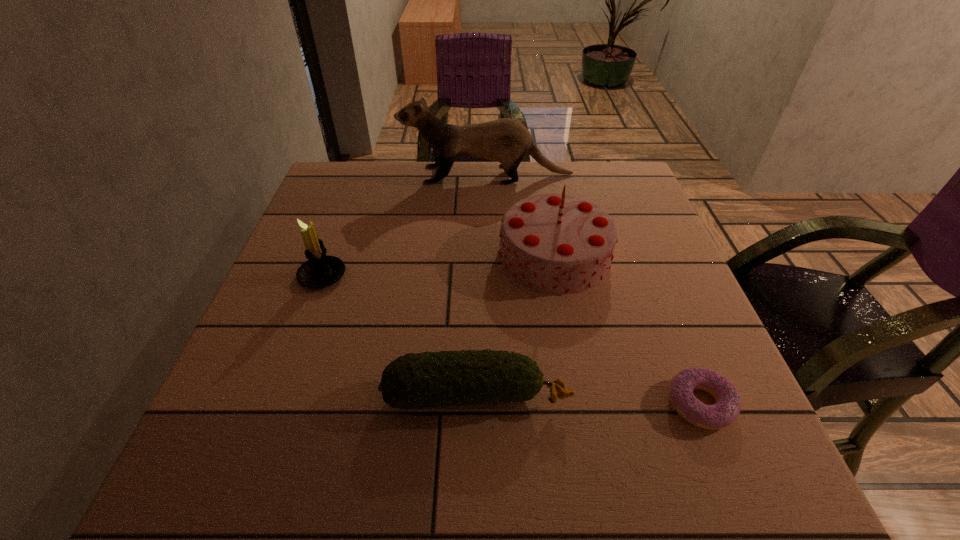
This screenshot has height=540, width=960. Identify the location of vacant region at the right edge of the desktop. (610, 209).

Where is `vacant space at the far left corner of the desktop`? The height and width of the screenshot is (540, 960). vacant space at the far left corner of the desktop is located at coordinates (376, 175).

You are a GUI agent. You are given a task and a screenshot of the screen. Output one action in this format:
    pyautogui.click(x=<x>, y=<y>)
    Task: Click on the vacant space at the near left corner of the desktop
    Image resolution: width=960 pixels, height=540 pixels.
    Given the screenshot: What is the action you would take?
    pyautogui.click(x=187, y=496)

Where is `vacant space at the far right corner of the desktop`? The image size is (960, 540). vacant space at the far right corner of the desktop is located at coordinates (607, 174).

Where is `free point between the birthday cake and the leftmost object`? free point between the birthday cake and the leftmost object is located at coordinates (439, 266).

Where is `free spot between the second shortest object and the rightmost object`? free spot between the second shortest object and the rightmost object is located at coordinates (588, 400).

The height and width of the screenshot is (540, 960). I want to click on vacant area that lies between the fourth tallest object and the candle holder, so [x=399, y=335].

Where is `empty space that is in between the leftmost object and the shortest object`? This screenshot has height=540, width=960. empty space that is in between the leftmost object and the shortest object is located at coordinates (511, 340).

Identify the location of vacant space that is in between the leftmost object and the shortest object. The height and width of the screenshot is (540, 960). (511, 340).

Identify the location of free space between the candle holder and the second shortest object. The height and width of the screenshot is (540, 960). (399, 335).